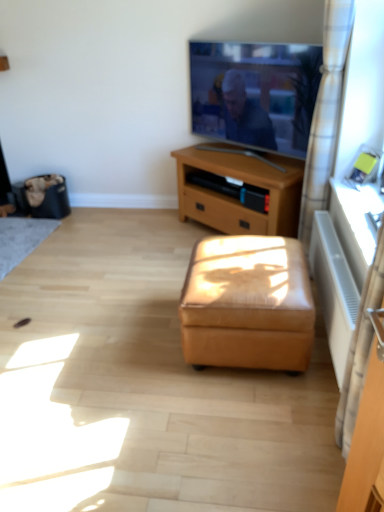
This screenshot has width=384, height=512. I want to click on free spot above leather ottoman at center (from a real-world perspective), so click(x=247, y=258).